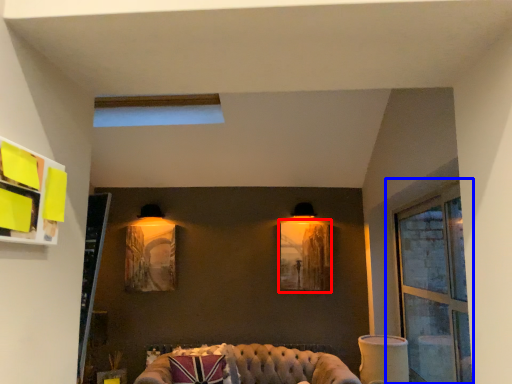
Question: Which object is further to the camera taking this photo, picture frame (highlighted by a red box) or window (highlighted by a blue box)?

Choices:
 (A) picture frame
 (B) window

Answer: (A)